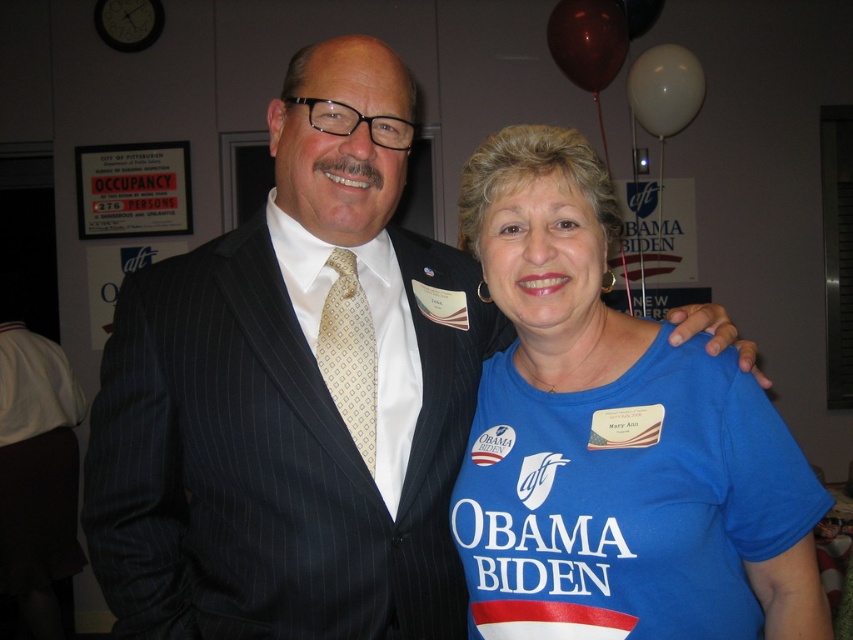
You are a photographer setting up for a group photo. You need to ensure that the dark pinstripe suit at center and the matte gold tie at center are visible in the frame. Based on their positions, which one should you adjust first to center both in the frame?

The dark pinstripe suit at center is positioned on the left side of the matte gold tie at center. To center both in the frame, you should adjust the matte gold tie at center first by moving it to the right, allowing the dark pinstripe suit at center to shift towards the center as well.